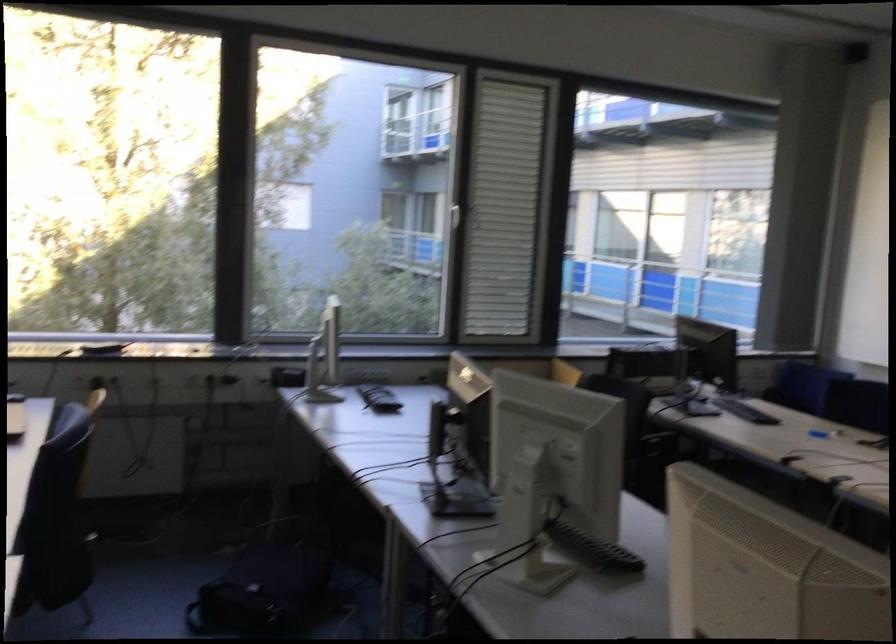
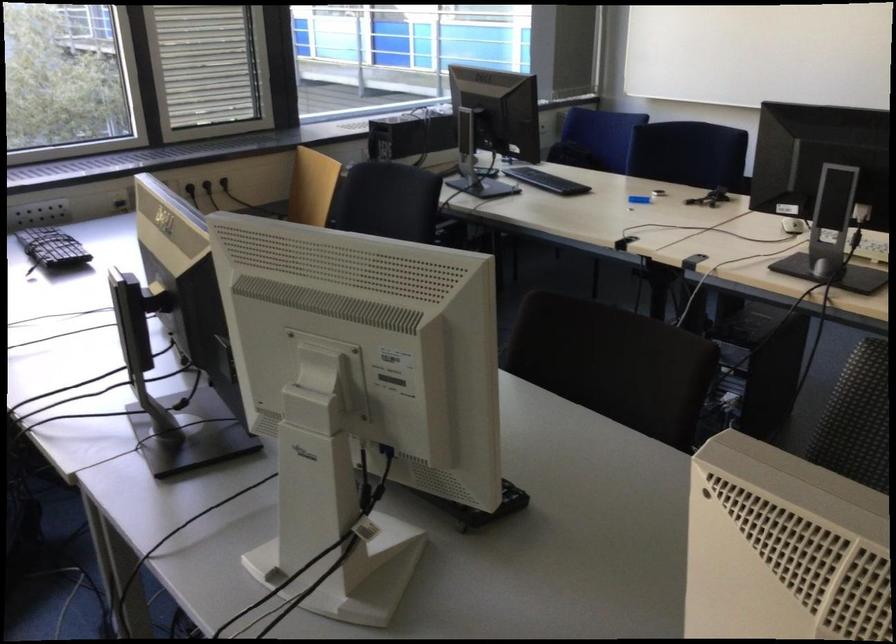
How did the camera likely rotate?

The camera rotated toward right-down.